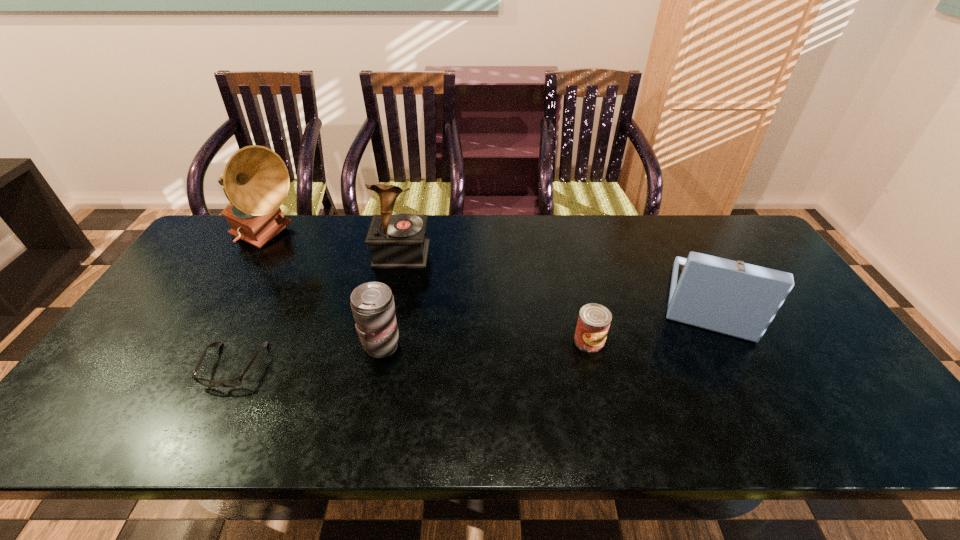
The width and height of the screenshot is (960, 540). What are the coordinates of `free location that satisfies the following two spatial constraints: 1. on the side of the fourth tallest object where the control switches are located; 2. on the front-facing side of the shortest object` in the screenshot? It's located at (378, 366).

The width and height of the screenshot is (960, 540). What are the coordinates of `vacant space that satisfies the following two spatial constraints: 1. on the front side of the fifth tallest object; 2. on the side of the telephoto lens where the control switches are located` in the screenshot? It's located at (590, 346).

Find the location of `vacant area in the image that satisfies the following two spatial constraints: 1. on the horn of the rightmost phonograph record; 2. on the left side of the tallest phonograph record`. vacant area in the image that satisfies the following two spatial constraints: 1. on the horn of the rightmost phonograph record; 2. on the left side of the tallest phonograph record is located at coordinates (229, 301).